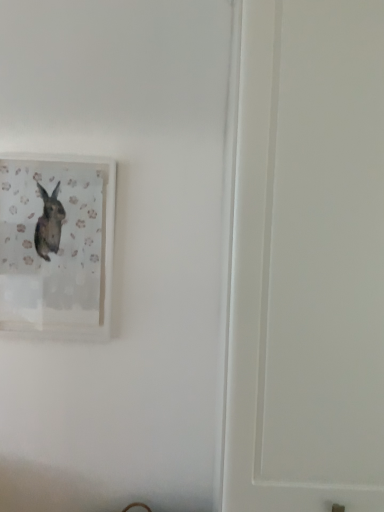
Describe the element at coordinates (57, 246) in the screenshot. The height and width of the screenshot is (512, 384). I see `matte paper picture frame at upper left` at that location.

At what (x,y) coordinates should I click in order to perform the action: click on matte paper picture frame at upper left. Please return your answer as a coordinate pair (x, y). The image size is (384, 512). Looking at the image, I should click on (57, 246).

This screenshot has height=512, width=384. I want to click on matte paper picture frame at upper left, so click(x=57, y=246).